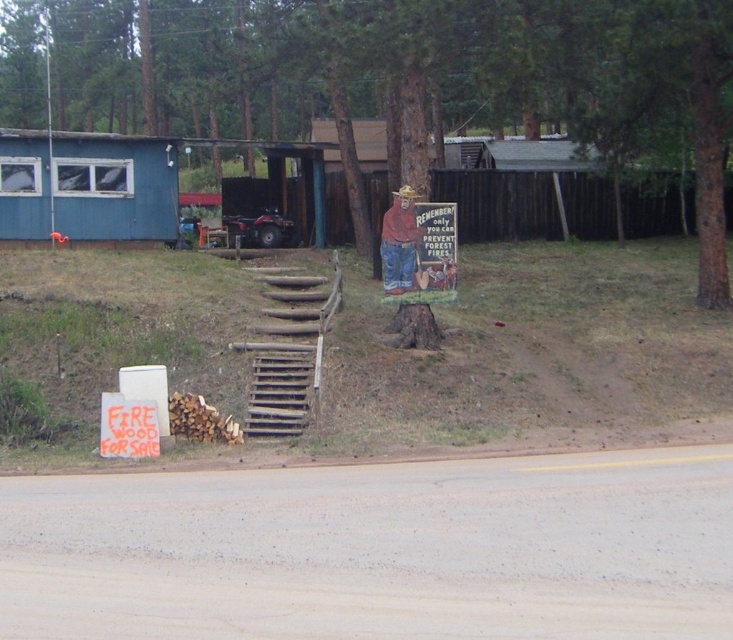
You are a hiker who just arrived at this rural area. You see the wooden stairs at center and the orange wood sign at lower left. Which object is taller?

The orange wood sign at lower left is taller than the wooden stairs at center.

You are a hiker carrying a heavy backpack and want to rest. You see a brown wood tree stump at center and wooden stairs at center. Which one is closer to you if you are standing on the dirt road?

The brown wood tree stump at center is closer to you since it is only 23.58 meters away from the wooden stairs at center, but since you are on the dirt road, the distance to each would depend on their positions relative to the road. However, based on the given information, the tree stump is closer to the stairs than the stairs are to themselves, which doesn

You are standing at the bottom of the wooden staircase and want to place a small potted plant exactly at the location marked by the point (397, 76). Is there enough space there to place it?

The brown wood tree stump at center is located at point (397, 76), so there is no space to place the potted plant there as the stump occupies that exact location.